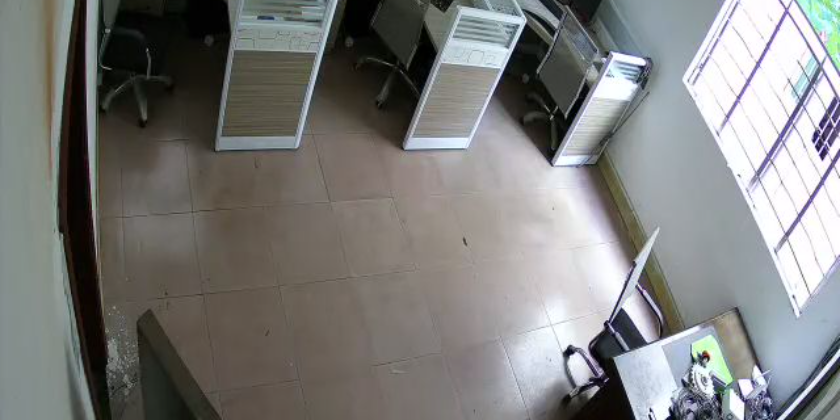
In order to click on dirt on floor in this screenshot , I will do `click(126, 330)`.